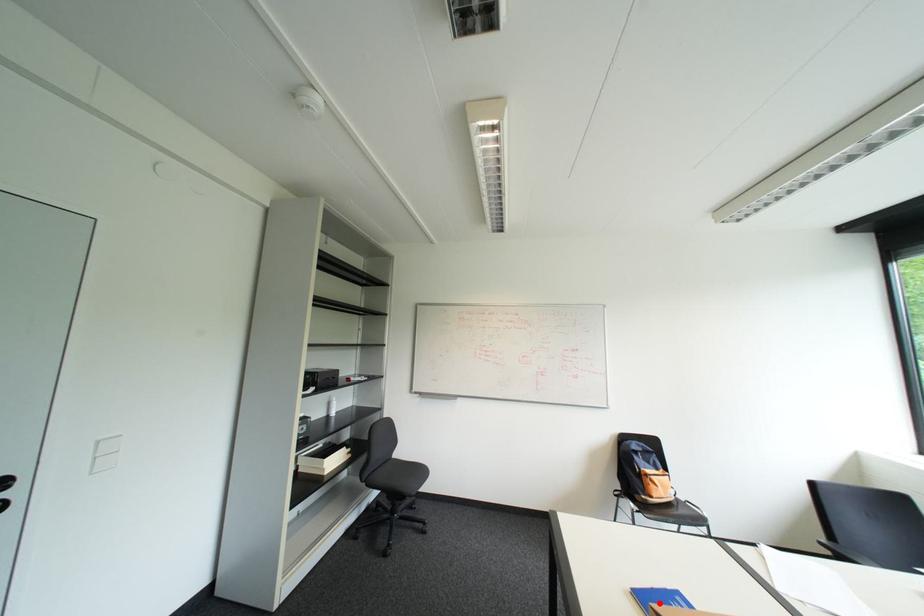
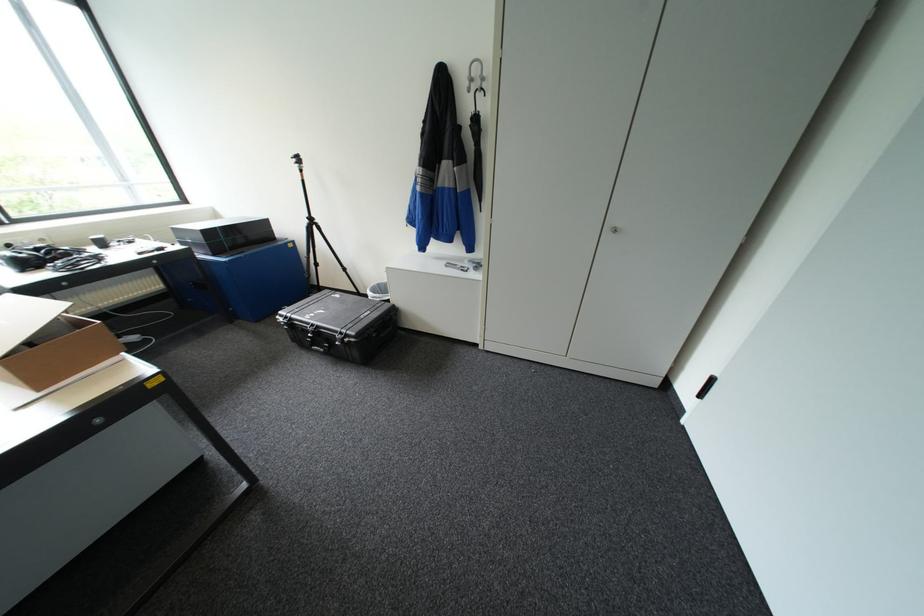
Question: I am providing you with two images of the same scene from different viewpoints. A red point is marked on the first image. Can you still see the location of the red point in image 2?

Choices:
 (A) Yes
 (B) No

Answer: (B)